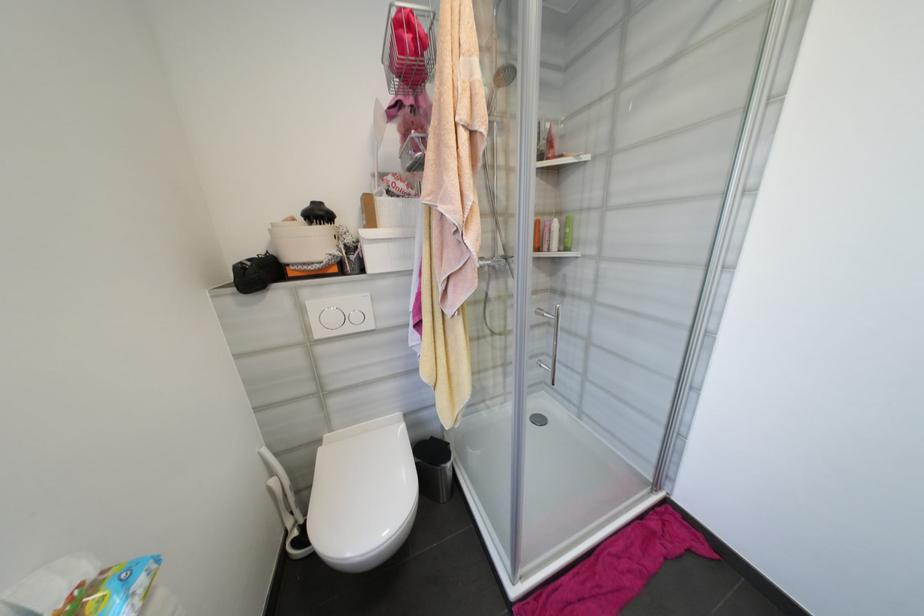
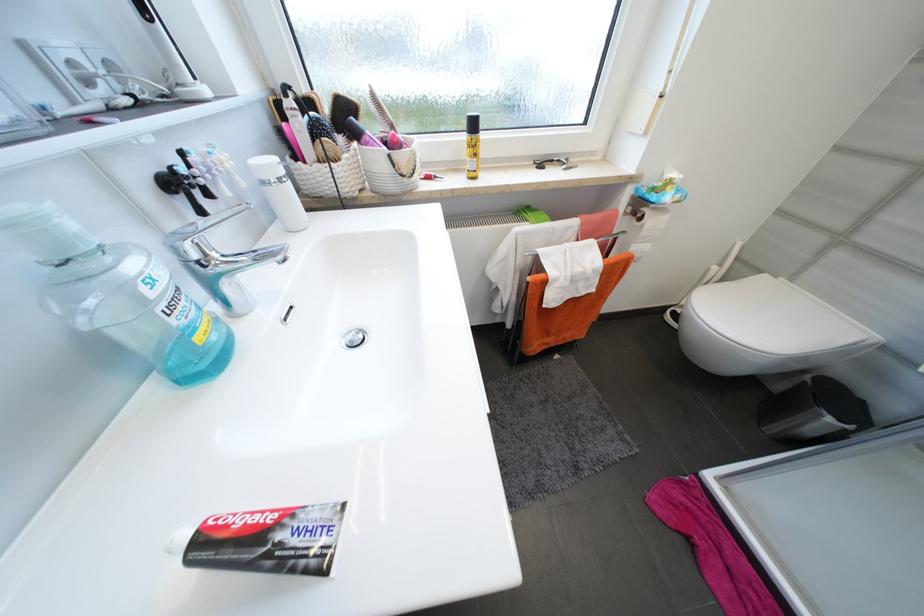
First-person continuous shooting, in which direction is the camera rotating?

The rotation direction of the camera is left-down.